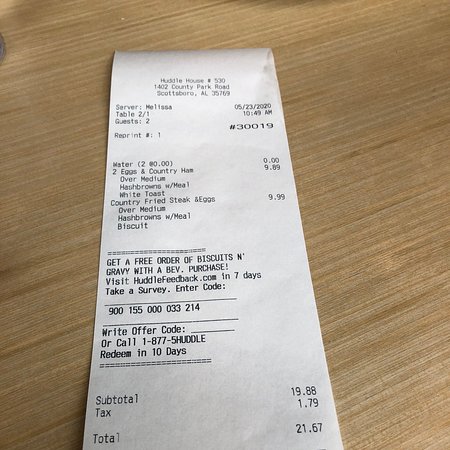
Find the location of a particular element. The image size is (450, 450). light glare on table is located at coordinates (230, 25).